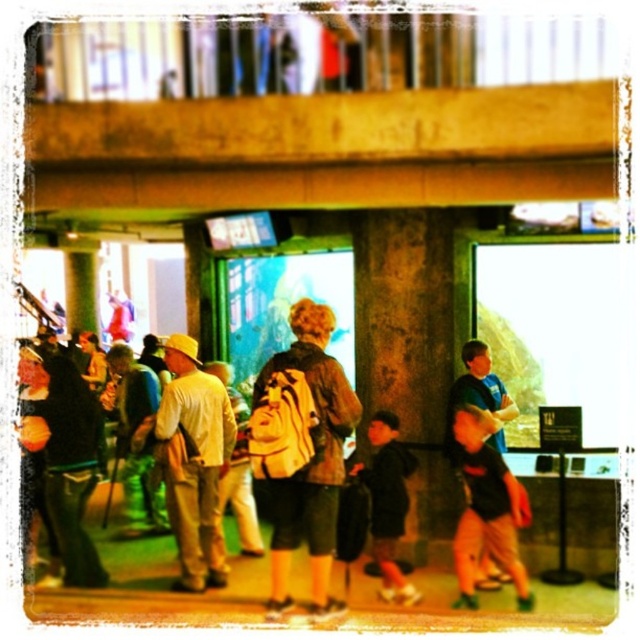
Question: Among these objects, which one is nearest to the camera?

Choices:
 (A) white backpack at center
 (B) light beige cotton shirt at center

Answer: (B)

Question: Is matte brown backpack at center above black matte jacket at center?

Choices:
 (A) no
 (B) yes

Answer: (B)

Question: Does dark green pants at left have a smaller size compared to black matte jacket at center?

Choices:
 (A) yes
 (B) no

Answer: (B)

Question: Which point is farther to the camera?

Choices:
 (A) (134, 461)
 (B) (44, 464)

Answer: (B)

Question: Is light beige cotton shirt at center further to the viewer compared to black cotton shirt at center?

Choices:
 (A) yes
 (B) no

Answer: (A)

Question: Estimate the real-world distances between objects in this image. Which object is closer to the white backpack at center?

Choices:
 (A) black cotton shirt at center
 (B) concrete textured pillar at center
 (C) light beige cotton shirt at center

Answer: (C)